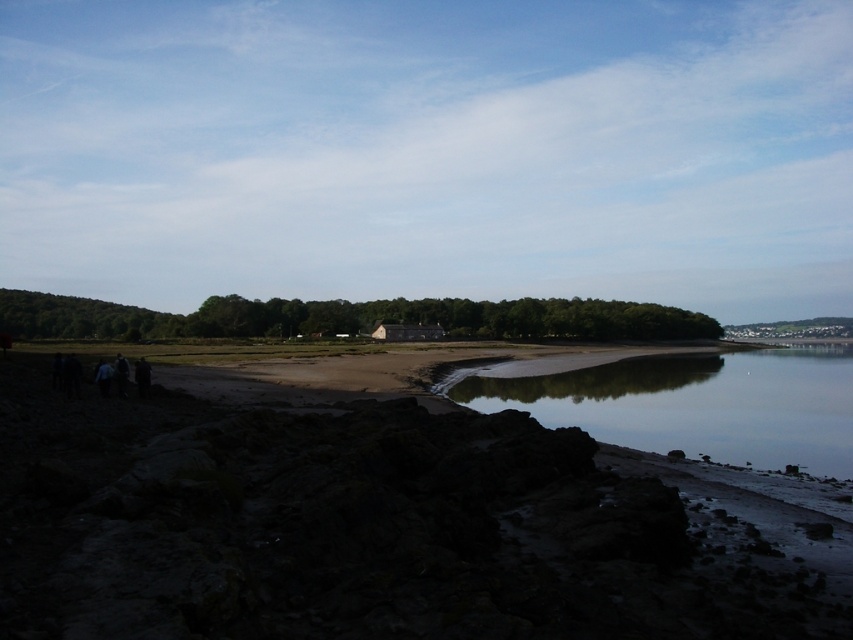
Which is above, dark sand beach at center or reflective smooth water at lower center?

dark sand beach at center is above.

Is dark sand beach at center further to the viewer compared to reflective smooth water at lower center?

That is False.

Where is `dark sand beach at center`? Image resolution: width=853 pixels, height=640 pixels. dark sand beach at center is located at coordinates (355, 529).

Which is more to the left, dark sand beach at center or dark gray wooden hut at center?

Positioned to the left is dark gray wooden hut at center.

Which is below, dark sand beach at center or dark gray wooden hut at center?

dark sand beach at center is below.

What do you see at coordinates (355, 529) in the screenshot?
I see `dark sand beach at center` at bounding box center [355, 529].

Where is `dark sand beach at center`? dark sand beach at center is located at coordinates click(355, 529).

Can you confirm if reflective smooth water at lower center is positioned to the right of dark gray wooden hut at center?

Correct, you'll find reflective smooth water at lower center to the right of dark gray wooden hut at center.

Which is below, reflective smooth water at lower center or dark gray wooden hut at center?

Positioned lower is reflective smooth water at lower center.

Is point (732, 356) positioned after point (401, 332)?

No.

The image size is (853, 640). Identify the location of reflective smooth water at lower center. (697, 404).